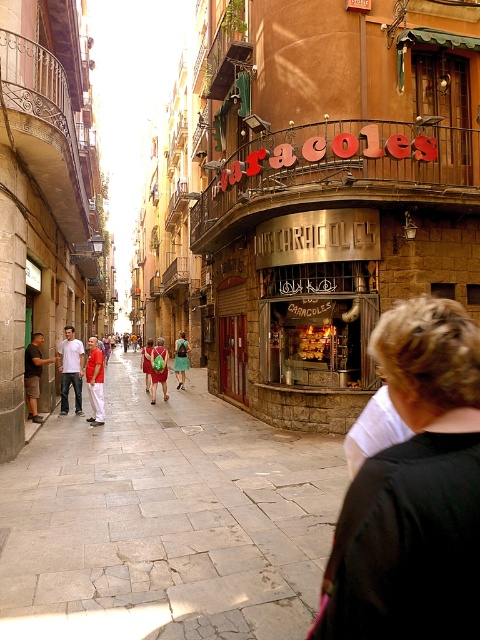
You are a tailor who needs to determine if the matte khaki shorts at left can fit into the green fabric bag at center. Based on their sizes, can the shorts fit inside the bag?

The matte khaki shorts at left are narrower than the green fabric bag at center, so they should fit inside the bag.

You are a tourist in this Spanish city and see two red items of clothing in the scene. The red shirt at center and the red fabric pants at left. Which one is positioned lower in the image?

The red shirt at center is located below red fabric pants at left, so the red shirt at center is positioned lower in the image.

You are standing in the lively street scene in front of the corner building with the curved storefront labeled Los Caracoles. There are two points marked on the image at coordinates point (200, 584) and point (147, 378). Which of these two points is closer to your current position?

Point (200, 584) is closer to the camera than point (147, 378), so the point at (200, 584) is closer to your current position.